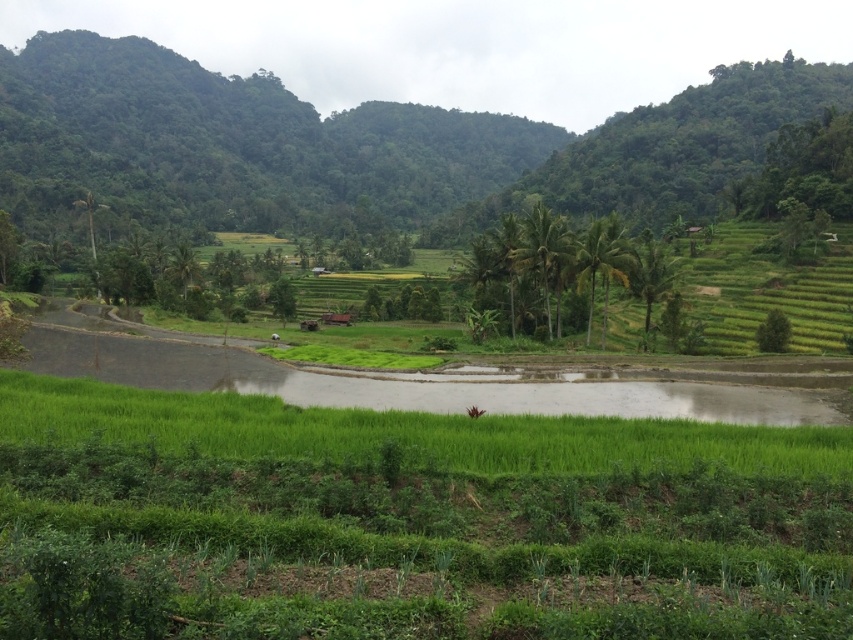
Question: Does green grassy rice field at center appear over green leafy mountain at center?

Choices:
 (A) no
 (B) yes

Answer: (A)

Question: Can you confirm if green grassy rice field at center is positioned to the right of green leafy mountain at center?

Choices:
 (A) no
 (B) yes

Answer: (B)

Question: Is the position of green grassy rice field at center less distant than that of green leafy mountain at center?

Choices:
 (A) yes
 (B) no

Answer: (A)

Question: Among these objects, which one is nearest to the camera?

Choices:
 (A) green leafy mountain at center
 (B) green grassy rice field at center

Answer: (B)